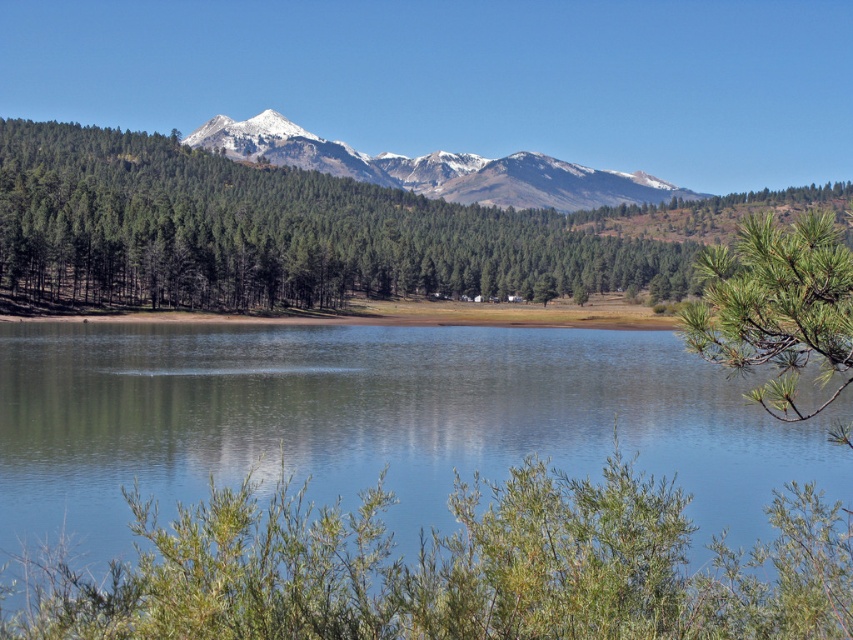
You are standing at point (273, 234) in the serene landscape. What object is located exactly at your current position?

The green matte tree at center is located exactly at point (273, 234).

You are an environmental scientist studying the landscape. You observe the green matte tree at center and the snowy rocky mountains at center. Which object is located to the right of the other?

The green matte tree at center is positioned on the right side of snowy rocky mountains at center.